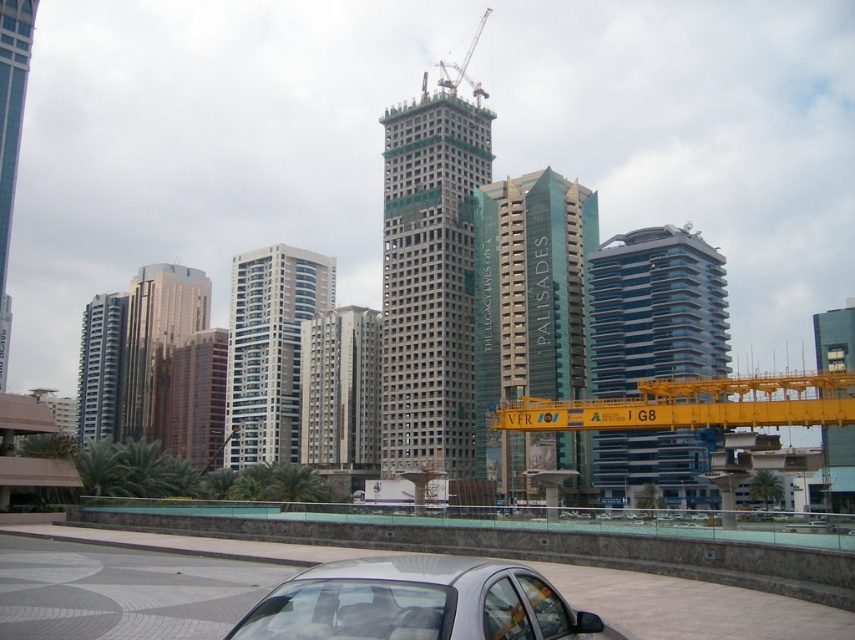
Question: Which point is closer to the camera taking this photo?

Choices:
 (A) (16, 122)
 (B) (305, 445)
 (C) (187, 340)

Answer: (A)

Question: Which of the following is the farthest from the observer?

Choices:
 (A) (322, 420)
 (B) (10, 48)

Answer: (A)

Question: Which of these objects is positioned closest to the sleek metallic car at lower center?

Choices:
 (A) satin silver car at lower center
 (B) glossy glass building at center
 (C) transparent glass tower at right

Answer: (A)

Question: Considering the relative positions of yellow metallic crane at center and gray concrete building at center in the image provided, where is yellow metallic crane at center located with respect to gray concrete building at center?

Choices:
 (A) above
 (B) below

Answer: (A)

Question: In this image, where is sleek metallic car at lower center located relative to white glass building at center?

Choices:
 (A) above
 (B) below

Answer: (B)

Question: Does yellow metallic crane at center appear on the left side of glossy glass building at center?

Choices:
 (A) no
 (B) yes

Answer: (A)